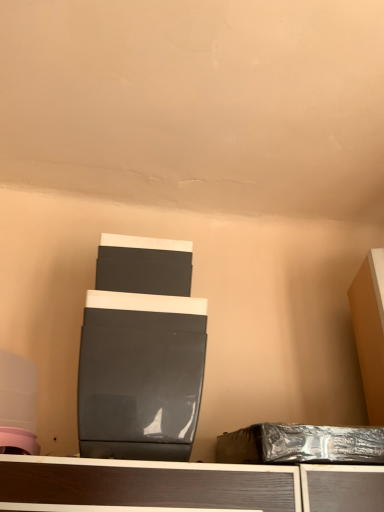
Question: Is glossy black speaker at center beside matte orange cabinet at right?

Choices:
 (A) no
 (B) yes

Answer: (A)

Question: Can you confirm if glossy black speaker at center is bigger than matte orange cabinet at right?

Choices:
 (A) no
 (B) yes

Answer: (B)

Question: Does glossy black speaker at center have a lesser height compared to matte orange cabinet at right?

Choices:
 (A) yes
 (B) no

Answer: (A)

Question: Can you confirm if glossy black speaker at center is thinner than matte orange cabinet at right?

Choices:
 (A) no
 (B) yes

Answer: (A)

Question: From the image's perspective, is glossy black speaker at center under matte orange cabinet at right?

Choices:
 (A) yes
 (B) no

Answer: (A)

Question: Is shiny metallic box at lower right inside the boundaries of glossy black speaker at center, or outside?

Choices:
 (A) inside
 (B) outside

Answer: (B)

Question: In terms of height, does shiny metallic box at lower right look taller or shorter compared to glossy black speaker at center?

Choices:
 (A) tall
 (B) short

Answer: (B)

Question: From the image's perspective, is shiny metallic box at lower right above or below glossy black speaker at center?

Choices:
 (A) above
 (B) below

Answer: (B)

Question: Would you say shiny metallic box at lower right is to the left or to the right of glossy black speaker at center in the picture?

Choices:
 (A) left
 (B) right

Answer: (B)

Question: Is matte orange cabinet at right bigger or smaller than shiny metallic box at lower right?

Choices:
 (A) big
 (B) small

Answer: (A)

Question: From the image's perspective, is matte orange cabinet at right positioned above or below shiny metallic box at lower right?

Choices:
 (A) above
 (B) below

Answer: (A)

Question: Which is correct: matte orange cabinet at right is inside shiny metallic box at lower right, or outside of it?

Choices:
 (A) inside
 (B) outside

Answer: (B)

Question: Visually, is matte orange cabinet at right positioned to the left or to the right of shiny metallic box at lower right?

Choices:
 (A) right
 (B) left

Answer: (A)

Question: From a real-world perspective, is glossy black speaker at center physically located above or below shiny metallic box at lower right?

Choices:
 (A) below
 (B) above

Answer: (B)

Question: Is glossy black speaker at center wider or thinner than shiny metallic box at lower right?

Choices:
 (A) wide
 (B) thin

Answer: (A)